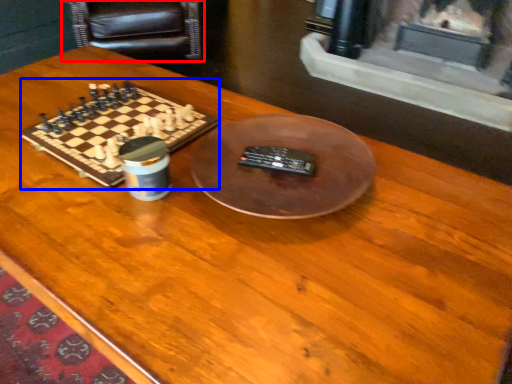
Question: Which of the following is the closest to the observer, armchair (highlighted by a red box) or board game (highlighted by a blue box)?

Choices:
 (A) armchair
 (B) board game

Answer: (B)